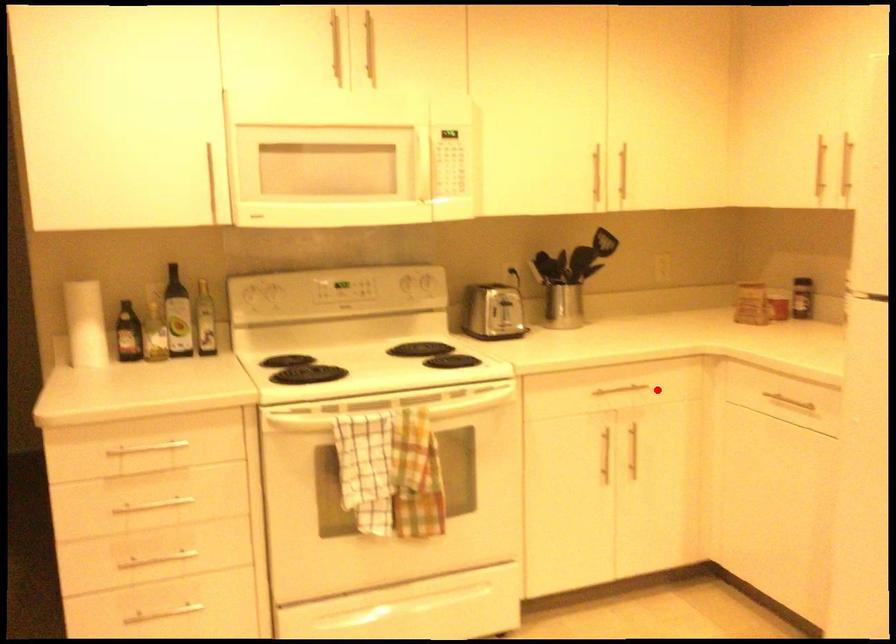
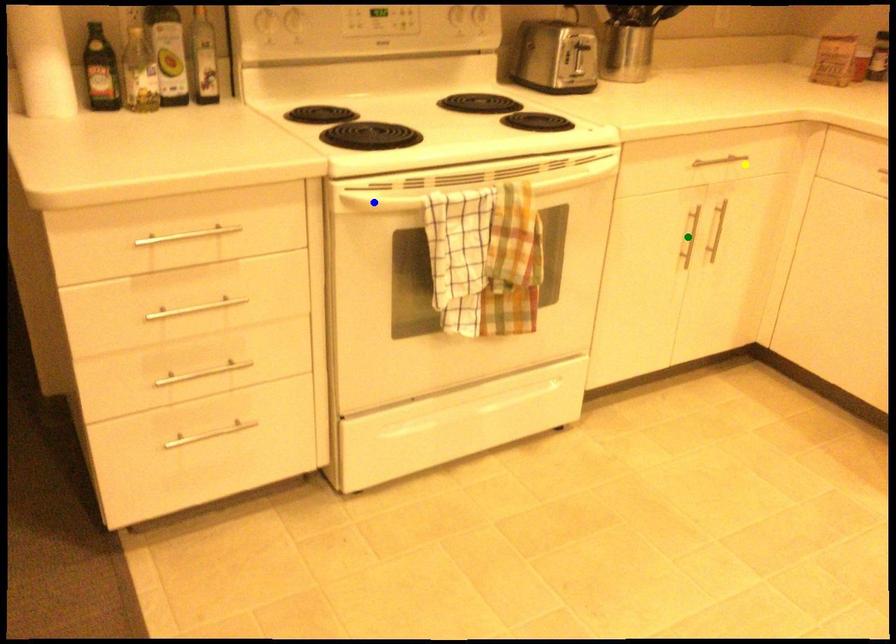
Question: I am providing you with two images of the same scene from different viewpoints. A red point is marked on the first image. You are given multiple points on the second image. Can you choose the point in image 2 that corresponds to the point in image 1?

Choices:
 (A) yellow point
 (B) blue point
 (C) green point

Answer: (A)